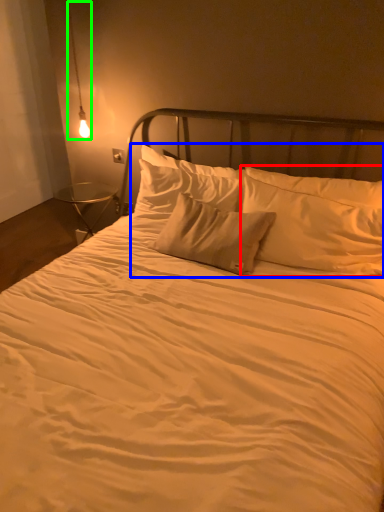
Question: Which object is positioned farthest from pillow (highlighted by a red box)? Select from pillow (highlighted by a blue box) and lamp (highlighted by a green box).

Choices:
 (A) pillow
 (B) lamp

Answer: (B)